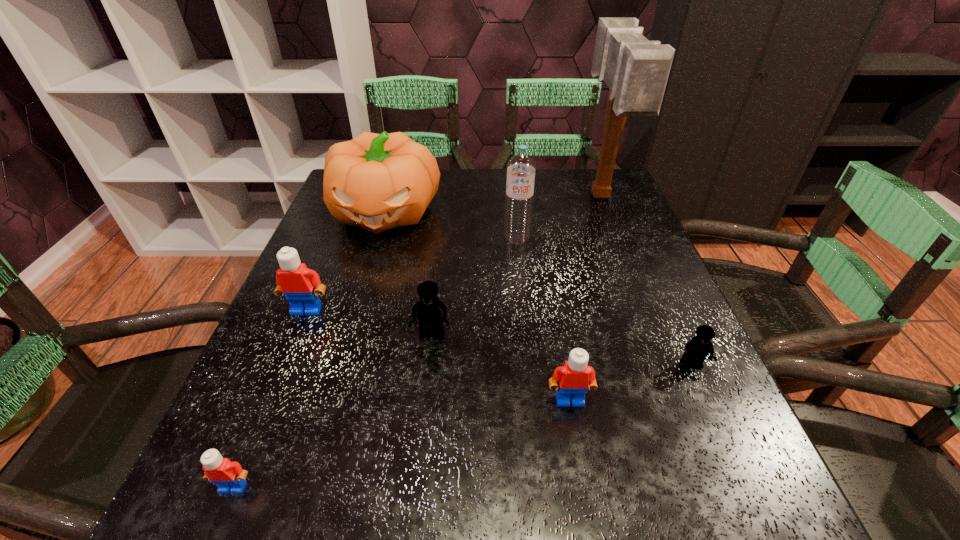
You are a GUI agent. You are given a task and a screenshot of the screen. Output one action in this format:
    pyautogui.click(x=<x>, y=<y>)
    Task: Click on the third farthest Lego
    This screenshot has width=960, height=540.
    Given the screenshot: What is the action you would take?
    pyautogui.click(x=698, y=348)

The height and width of the screenshot is (540, 960). Identify the location of the third nearest object. (698, 348).

You are a GUI agent. You are given a task and a screenshot of the screen. Output one action in this format:
    pyautogui.click(x=<x>, y=<y>)
    Task: Click on the smallest white Lego
    Image resolution: width=960 pixels, height=540 pixels.
    Given the screenshot: What is the action you would take?
    pyautogui.click(x=229, y=476)

I want to click on the nearest object, so click(229, 476).

Where is `free space located 0.290m on the left of the wood mallet`? free space located 0.290m on the left of the wood mallet is located at coordinates (477, 198).

Find the location of `free spot located 0.080m on the front of the water bottle`. free spot located 0.080m on the front of the water bottle is located at coordinates (520, 267).

This screenshot has height=540, width=960. I want to click on vacant space located on the carved face of the pumpkin, so click(353, 321).

Identify the location of vacant space located on the face of the biggest white Lego. The width and height of the screenshot is (960, 540). (276, 386).

Identify the location of vacant space located 0.130m on the face of the second nearest white Lego. The image size is (960, 540). (586, 490).

This screenshot has width=960, height=540. What are the coordinates of `free space located on the front-facing side of the fourth nearest object` in the screenshot? It's located at (411, 520).